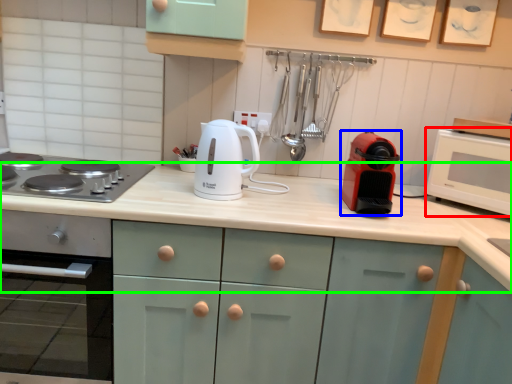
Question: Which object is the closest to the microwave oven (highlighted by a red box)? Choose among these: kitchen appliance (highlighted by a blue box) or countertop (highlighted by a green box).

Choices:
 (A) kitchen appliance
 (B) countertop

Answer: (A)